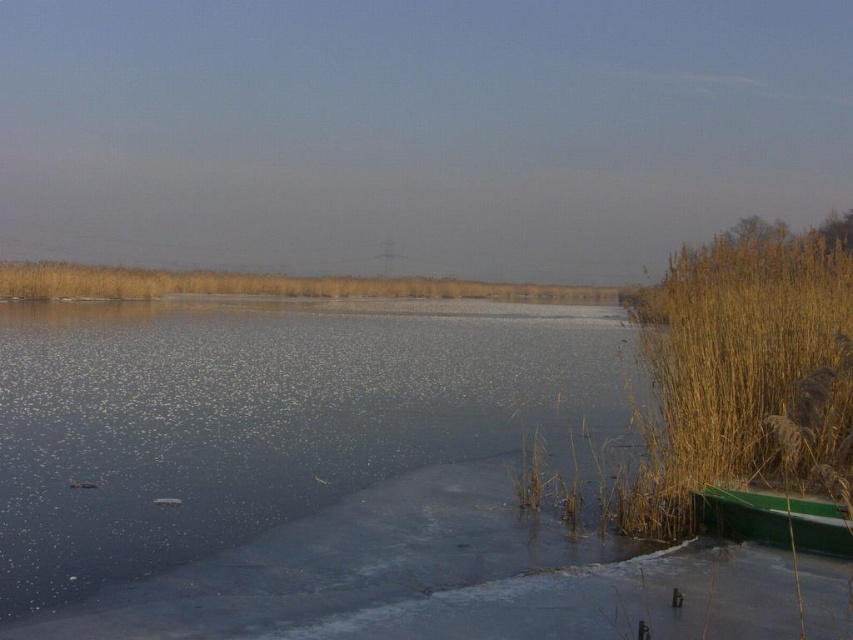
Can you confirm if translucent ice at center is shorter than green plastic canoe at lower right?

No, translucent ice at center is not shorter than green plastic canoe at lower right.

Does translucent ice at center have a greater height compared to green plastic canoe at lower right?

Indeed, translucent ice at center has a greater height compared to green plastic canoe at lower right.

Is point (78, 568) farther from viewer compared to point (746, 536)?

That is False.

Locate an element on the screen. This screenshot has height=640, width=853. translucent ice at center is located at coordinates (260, 419).

Can you confirm if brown grass at center is thinner than green plastic canoe at lower right?

Incorrect, brown grass at center's width is not less than green plastic canoe at lower right's.

Describe the element at coordinates (264, 285) in the screenshot. This screenshot has height=640, width=853. I see `brown grass at center` at that location.

Does point (308, 284) lie in front of point (827, 554)?

That is False.

Locate an element on the screen. The height and width of the screenshot is (640, 853). brown grass at center is located at coordinates (264, 285).

Is translucent ice at center above brown grass at center?

Actually, translucent ice at center is below brown grass at center.

Is translucent ice at center wider than brown grass at center?

No.

Is point (453, 412) farther from viewer compared to point (590, 296)?

No.

The image size is (853, 640). What are the coordinates of `translucent ice at center` in the screenshot? It's located at (260, 419).